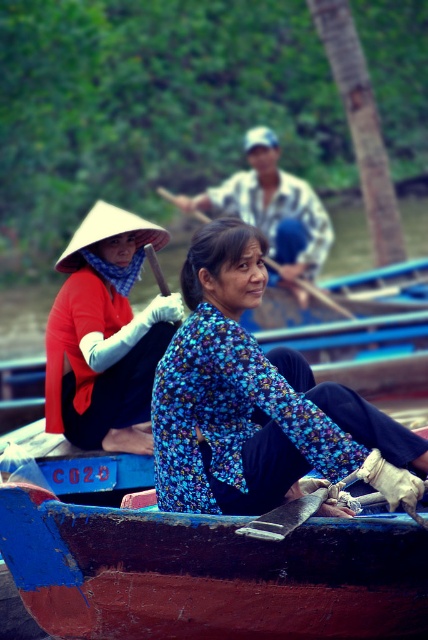
You are a photographer taking a picture of the floral fabric woman at center and the wooden smooth paddle at center. Based on their positions, which object is closer to the camera?

The floral fabric woman at center is positioned over the wooden smooth paddle at center, so she is closer to the camera.

You are a photographer trying to capture a closeup of the floral fabric woman at center and the wooden smooth paddle at center. Which object is wider in the image?

The floral fabric woman at center is wider than the wooden smooth paddle at center according to the description.

From the picture: You are a photographer taking pictures of the floral fabric woman at center and the wooden smooth paddle at center. Which object should you focus on first if you want to capture the taller one?

The floral fabric woman at center is taller than the wooden smooth paddle at center, so you should focus on the floral fabric woman at center first.